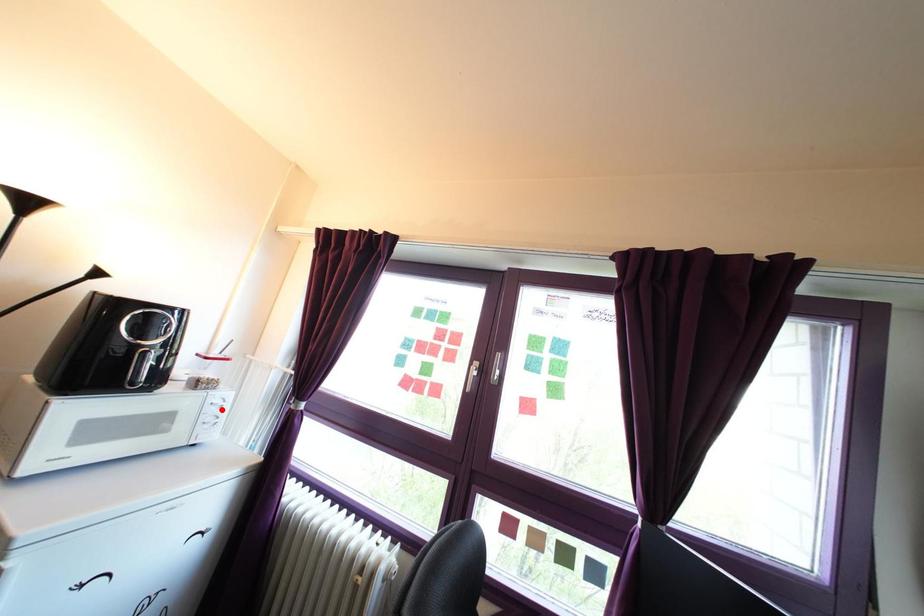
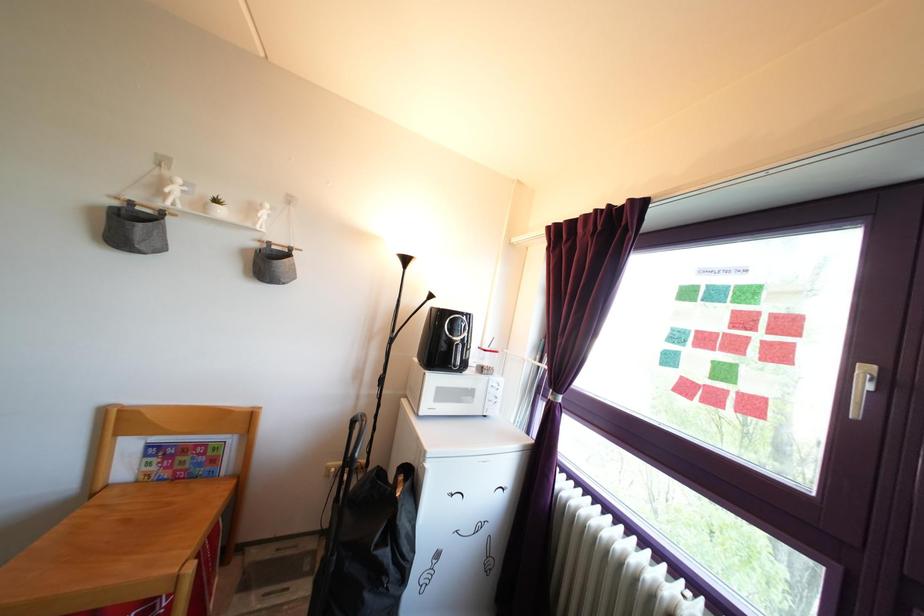
Find the pixel in the second image that matches the highlighted location in the first image.

(499, 394)